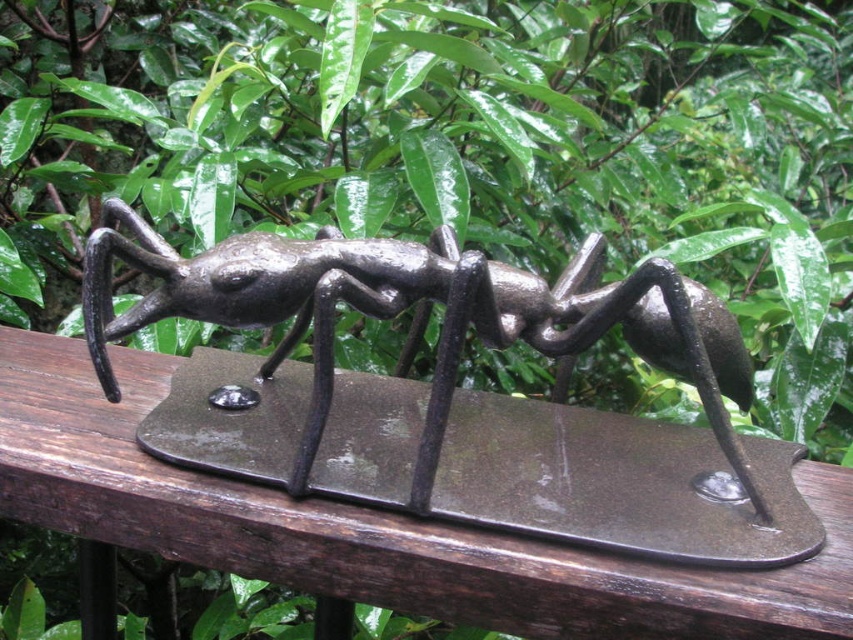
Question: Does brown wood rail at center have a smaller size compared to shiny black ant at center?

Choices:
 (A) yes
 (B) no

Answer: (B)

Question: Does brown wood rail at center have a lesser width compared to shiny black ant at center?

Choices:
 (A) yes
 (B) no

Answer: (B)

Question: Which point appears closest to the camera in this image?

Choices:
 (A) (171, 368)
 (B) (401, 308)

Answer: (B)

Question: Which of the following is the farthest from the observer?

Choices:
 (A) (619, 621)
 (B) (221, 264)

Answer: (B)

Question: Which of the following is the farthest from the observer?

Choices:
 (A) (250, 266)
 (B) (51, 385)

Answer: (B)

Question: From the image, what is the correct spatial relationship of brown wood rail at center in relation to shiny black ant at center?

Choices:
 (A) right
 (B) left

Answer: (B)